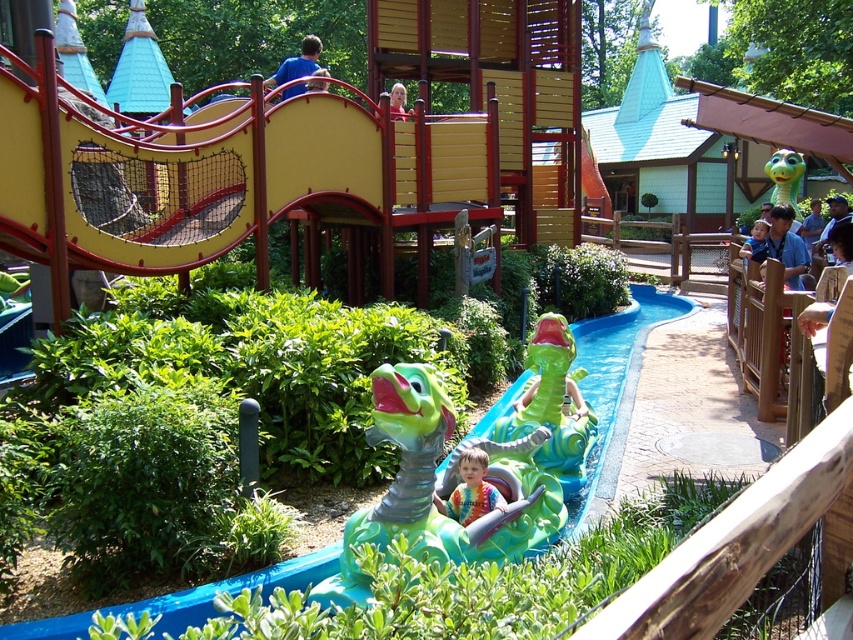
Describe the element at coordinates (786, 244) in the screenshot. I see `blue denim shirt at upper right` at that location.

How distant is blue denim shirt at upper right from blonde hair at upper center?

A distance of 20.84 feet exists between blue denim shirt at upper right and blonde hair at upper center.

The image size is (853, 640). Find the location of `blue denim shirt at upper right`. blue denim shirt at upper right is located at coordinates (786, 244).

Which is above, tie-dye fabric at center or blonde hair at upper center?

blonde hair at upper center is higher up.

Can you confirm if tie-dye fabric at center is thinner than blonde hair at upper center?

Yes.

Measure the distance between tie-dye fabric at center and camera.

tie-dye fabric at center is 4.16 meters from camera.

Identify the location of tie-dye fabric at center. (471, 490).

Measure the distance between tie-dye fabric at center and green rubber dinosaur at upper right.

The distance of tie-dye fabric at center from green rubber dinosaur at upper right is 17.25 meters.

I want to click on tie-dye fabric at center, so click(471, 490).